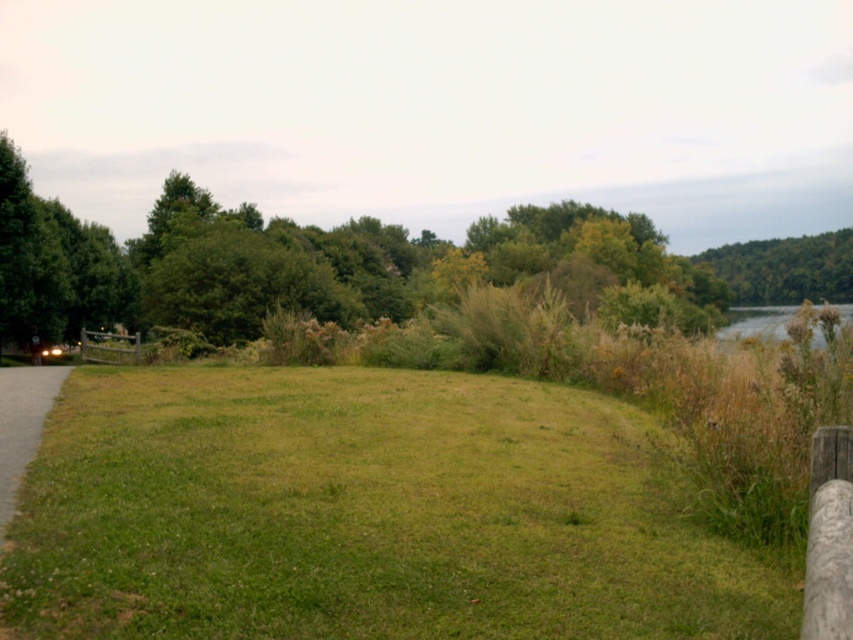
Between green grassy at center and green leafy hill at upper right, which one appears on the right side from the viewer's perspective?

green leafy hill at upper right is more to the right.

Who is positioned more to the left, green grassy at center or green leafy hill at upper right?

From the viewer's perspective, green grassy at center appears more on the left side.

Does point (635, 433) come in front of point (730, 246)?

Yes, point (635, 433) is in front of point (730, 246).

You are a GUI agent. You are given a task and a screenshot of the screen. Output one action in this format:
    pyautogui.click(x=<x>, y=<y>)
    Task: Click on the green grassy at center
    This screenshot has height=640, width=853.
    Given the screenshot: What is the action you would take?
    pyautogui.click(x=363, y=515)

Which is more to the left, green leafy tree at left or green leafy hill at upper right?

green leafy tree at left

Find the location of a particular element. The height and width of the screenshot is (640, 853). green leafy tree at left is located at coordinates [x=364, y=266].

Locate an element on the screen. green leafy tree at left is located at coordinates (364, 266).

Locate an element on the screen. The height and width of the screenshot is (640, 853). green grassy at center is located at coordinates pos(363,515).

Image resolution: width=853 pixels, height=640 pixels. I want to click on green grassy at center, so click(363, 515).

Find the location of a particular element. The image size is (853, 640). green grassy at center is located at coordinates (363, 515).